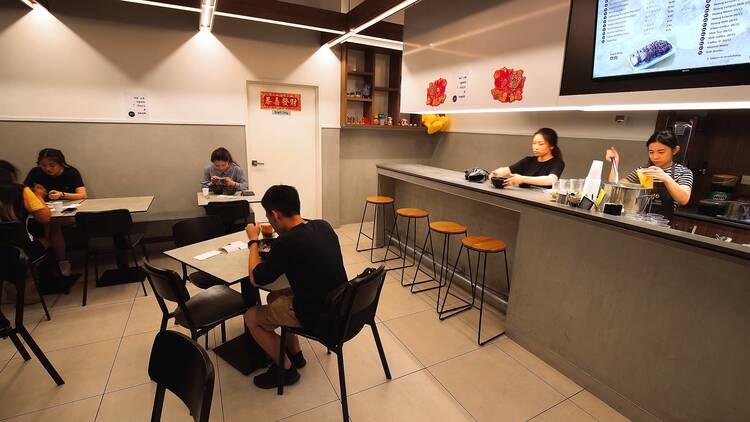
Identify the location of red decor signs. (494, 87), (441, 92), (274, 99).